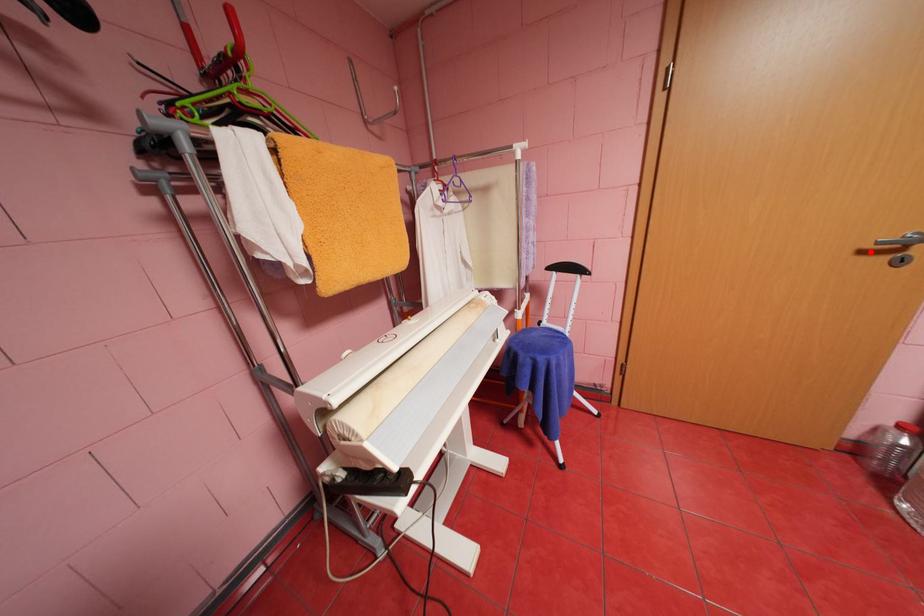
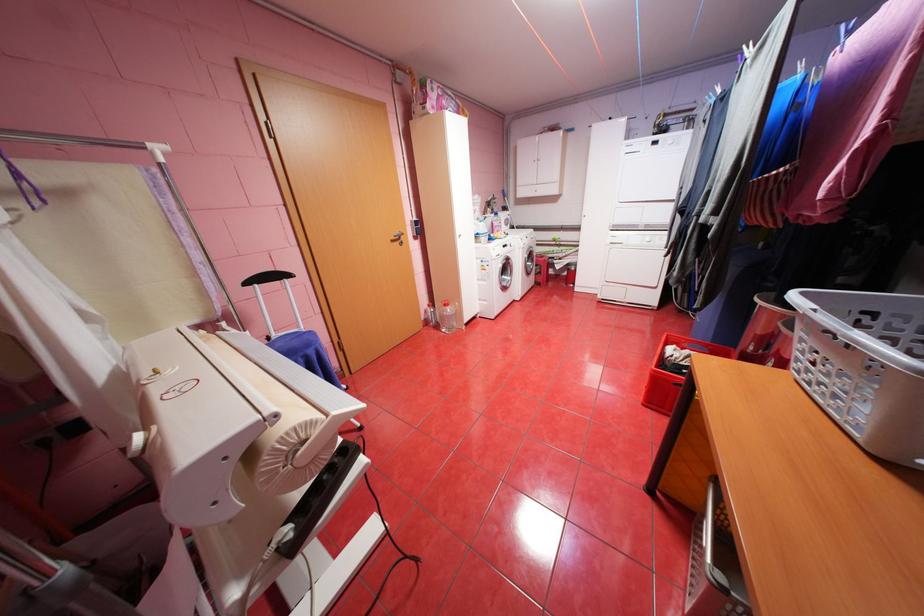
Locate, in the second image, the point that corresponds to the highlighted location in the first image.

(400, 241)